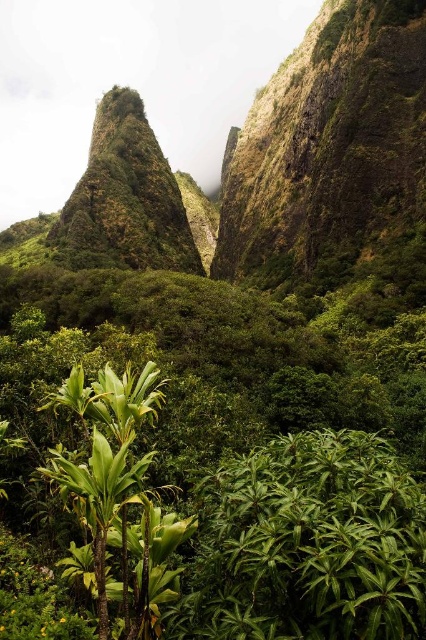
You are a hiker planning to cross between the green mossy rock at center and the green leafy plant at lower left. Given that your average walking pace is 1.5 meters per second, how many seconds will it take you to walk directly between them?

The distance between the green mossy rock at center and the green leafy plant at lower left is 119.31 meters. At a pace of 1.5 meters per second, it would take approximately 79.54 seconds to walk between them.

You are a hiker planning to navigate between the two points, point [167,221] and point [137,483]. Which point is closer to your current position if you are standing at the starting point?

Point [167,221] is further to the viewer than point [137,483], so the closer point to your current position would be point [137,483].

You are a hiker trying to navigate through the dense vegetation. You see the green mossy rock at center and the green leafy plant at lower left. Which object is taller and would block your view more if you are approaching from the front?

The green mossy rock at center is taller than the green leafy plant at lower left, so it would block your view more if you are approaching from the front.